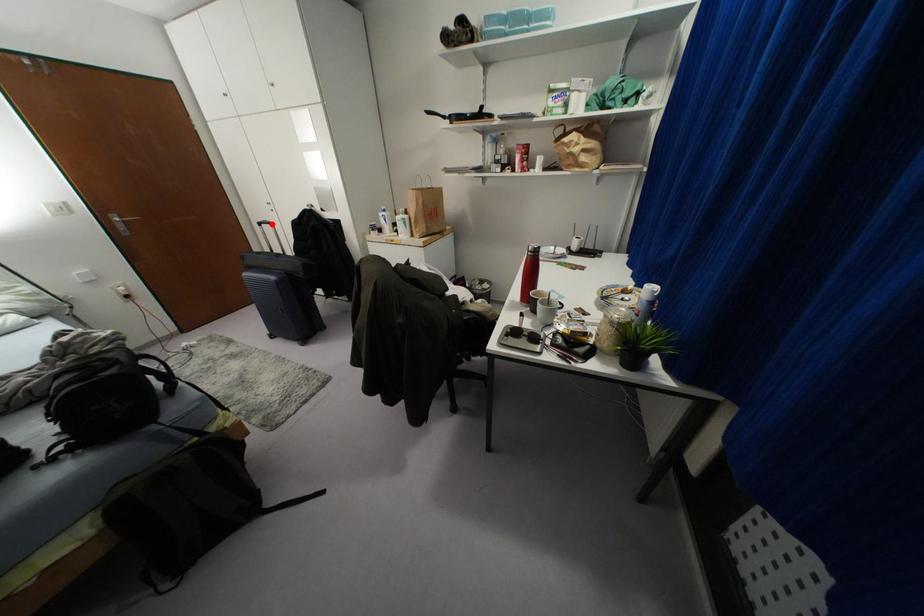
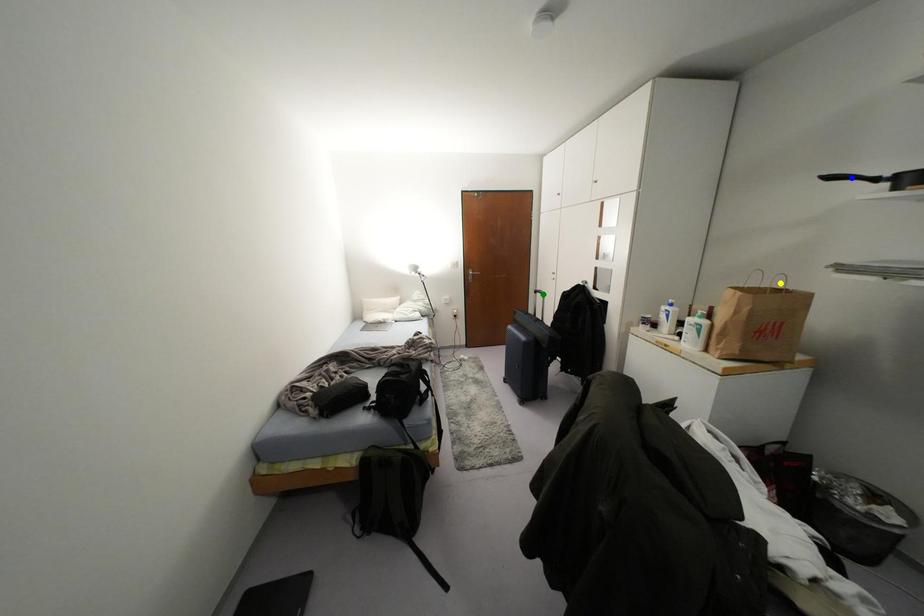
Question: I am providing you with two images of the same scene from different viewpoints. A red point is marked on the first image. You are given multiple points on the second image. Which spot in image 2 lines up with the point in image 1?

Choices:
 (A) yellow point
 (B) blue point
 (C) green point

Answer: (C)